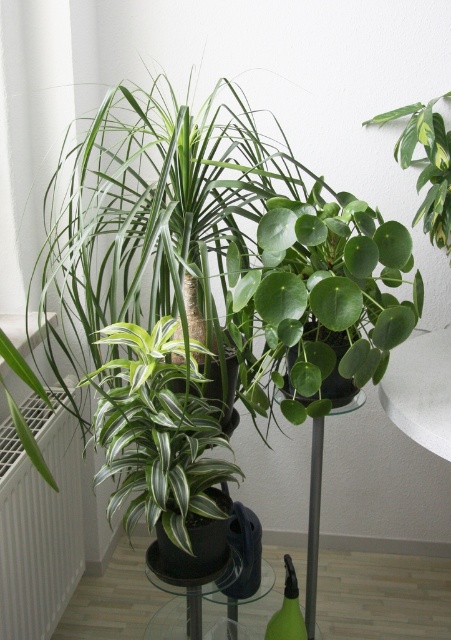
From the picture: You are standing in front of the table with two points marked on it. The first point is at coordinates point (x=55, y=605) and the second is at point (x=423, y=378). Which point is closer to you?

Point (x=55, y=605) is behind point (x=423, y=378), so the closer point to you is point (x=423, y=378).

Looking at this image, you are a gardener who wants to place a new plant between the green glossy leafy plant at center and the white metallic radiator at lower left. Which side should you place it closer to if you want it to receive more sunlight?

The white metallic radiator at lower left is taller than the green glossy leafy plant at center. Since the radiator is taller, placing the new plant closer to the radiator might block sunlight. Therefore, place it closer to the green glossy leafy plant at center to ensure it gets more sunlight.

You are arranging plants on a table and have two plants in the center. The green matte leafy plant at center and the green glossy leafy plant at center. Which one has a wider spread?

The green matte leafy plant at center is wider than the green glossy leafy plant at center according to the description.